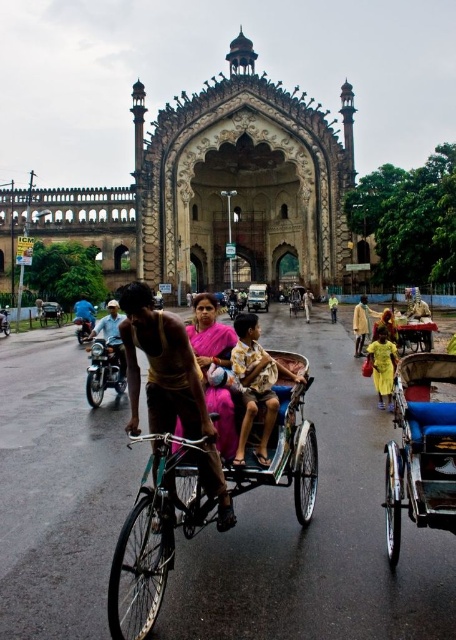
Question: Is green metallic bicycle at center smaller than brushed metal motorcycle at center?

Choices:
 (A) yes
 (B) no

Answer: (B)

Question: Which of the following is the closest to the observer?

Choices:
 (A) yellow fabric dress at center
 (B) shiny metallic motorcycle at left
 (C) shiny metallic motorcycle at center
 (D) shiny gold bicycle at center

Answer: (D)

Question: Which point appears farthest from the camera in this image?

Choices:
 (A) (93, 352)
 (B) (425, 336)

Answer: (B)

Question: Which object is the closest to the brushed metal motorcycle at center?

Choices:
 (A) brown leather jacket at center
 (B) blue fabric shirt at center

Answer: (B)

Question: In this image, where is blue fabric cart at right located relative to brushed metal motorcycle at center?

Choices:
 (A) below
 (B) above

Answer: (A)

Question: Does green metallic bicycle at center appear under shiny metallic motorcycle at left?

Choices:
 (A) no
 (B) yes

Answer: (B)